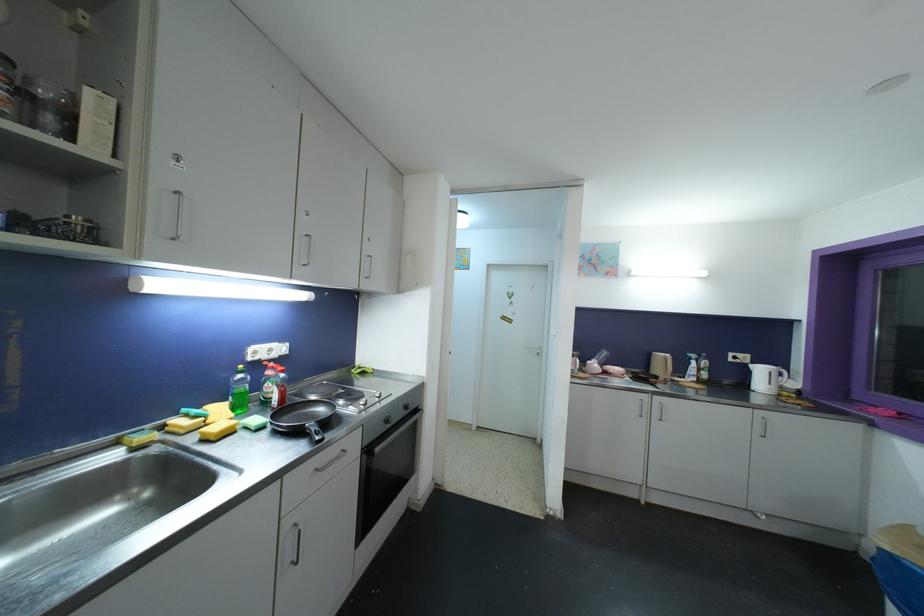
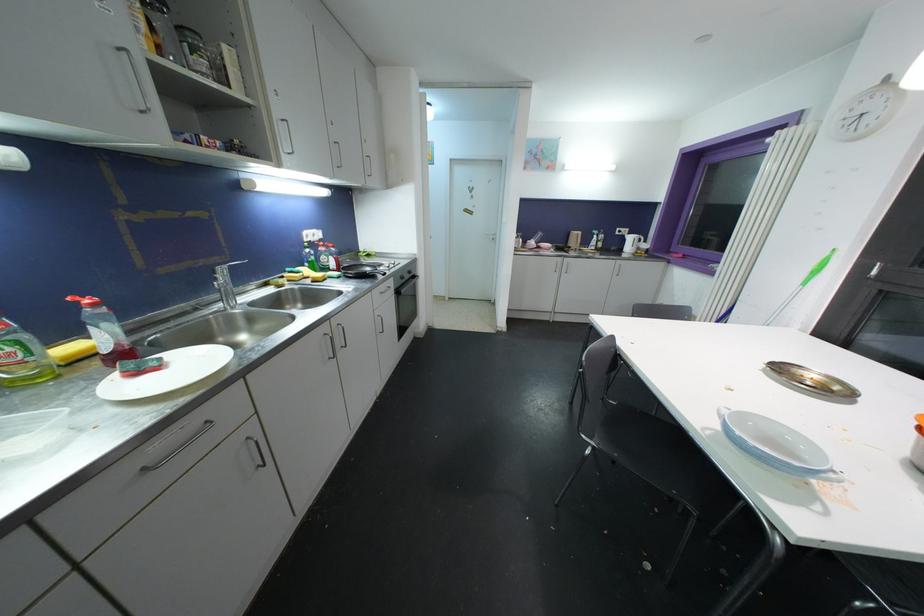
Find the pixel in the second image that matches point (371, 455) in the first image.

(400, 294)